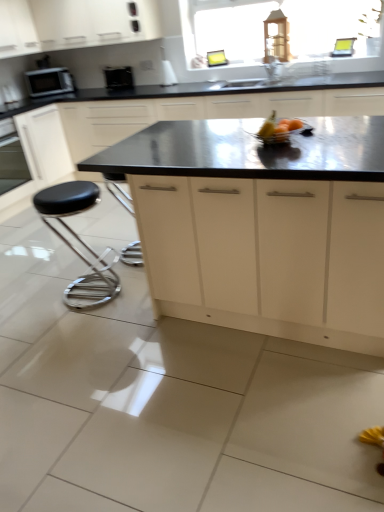
Question: From a real-world perspective, is white matte cabinet at upper center, the 2th cabinetry when ordered from bottom to top, positioned above or below white matte cabinet at upper center, which is the 1th cabinetry from top to bottom?

Choices:
 (A) above
 (B) below

Answer: (B)

Question: Based on their positions, is white matte cabinet at upper center, arranged as the 3th cabinetry when viewed from the top, located to the left or right of white matte cabinet at upper center, which is the 1th cabinetry from top to bottom?

Choices:
 (A) left
 (B) right

Answer: (B)

Question: Which is nearer to the satin white cabinet at center, acting as the 4th cabinetry starting from the top?

Choices:
 (A) metallic silver bowl at center
 (B) satin black microwave at upper left
 (C) black glossy microwave at upper left
 (D) white matte cabinet at upper center, the 4th cabinetry in the bottom-to-top sequence
 (E) black polished countertop at center

Answer: (A)

Question: Which object is the closest to the satin white cabinet at center, acting as the 4th cabinetry starting from the top?

Choices:
 (A) white matte cabinet at upper center, arranged as the 3th cabinetry when viewed from the top
 (B) satin black microwave at upper left
 (C) white matte cabinet at upper left, acting as the second cabinetry starting from the top
 (D) metallic silver bowl at center
 (E) black leather stool at lower left

Answer: (D)